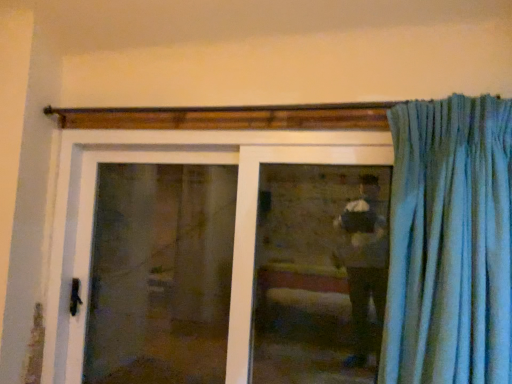
Question: From a real-world perspective, is transparent glass screen door at center above or below white plastic door at center?

Choices:
 (A) above
 (B) below

Answer: (A)

Question: Looking at the image, does transparent glass screen door at center seem bigger or smaller compared to white plastic door at center?

Choices:
 (A) small
 (B) big

Answer: (A)

Question: Based on their relative distances, which object is farther from the white plastic door at center?

Choices:
 (A) transparent glass screen door at center
 (B) clear glass window at center

Answer: (B)

Question: Which object is positioned closest to the clear glass window at center?

Choices:
 (A) transparent glass screen door at center
 (B) white plastic door at center

Answer: (B)